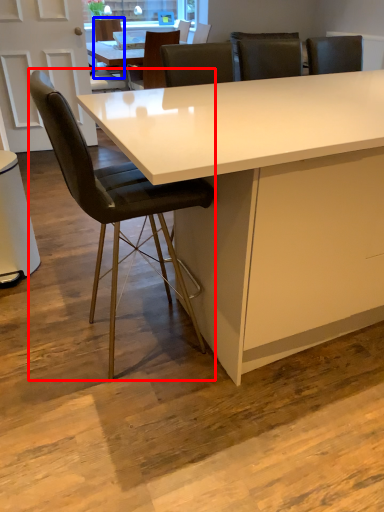
Question: Which object is closer to the camera taking this photo, chair (highlighted by a red box) or chair (highlighted by a blue box)?

Choices:
 (A) chair
 (B) chair

Answer: (A)